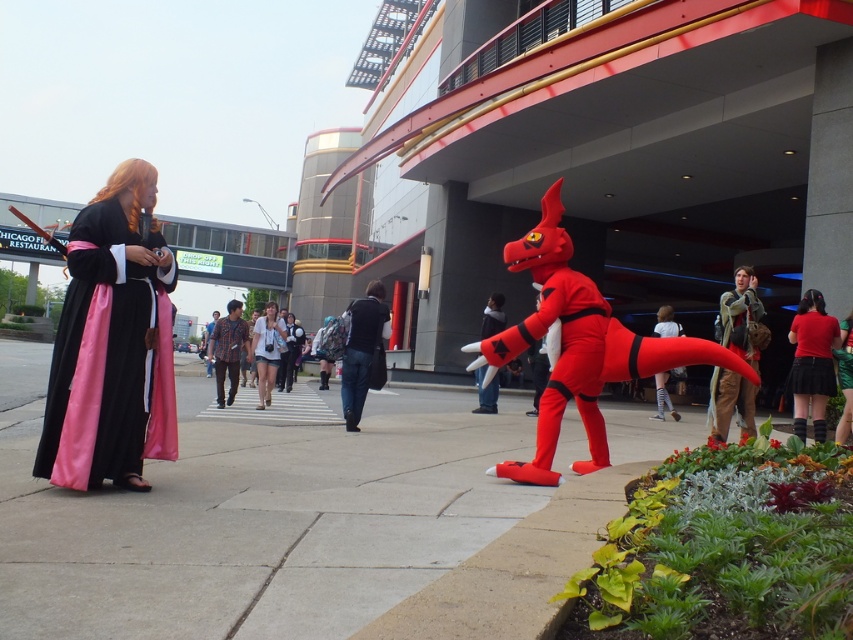
Question: Which point is closer to the camera?

Choices:
 (A) (476, 372)
 (B) (741, 339)
 (C) (276, 365)

Answer: (B)

Question: Which point is closer to the camera taking this photo?

Choices:
 (A) (358, 368)
 (B) (756, 333)

Answer: (B)

Question: Which of the following is the farthest from the observer?

Choices:
 (A) (718, 429)
 (B) (817, 394)

Answer: (B)

Question: Is the position of camouflage fabric jacket at right less distant than that of plaid fabric shirt at center?

Choices:
 (A) yes
 (B) no

Answer: (A)

Question: Is rubberized red dinosaur at center below plaid fabric shirt at center?

Choices:
 (A) yes
 (B) no

Answer: (B)

Question: Is rubberized red dinosaur at center wider than denim shorts at center?

Choices:
 (A) no
 (B) yes

Answer: (B)